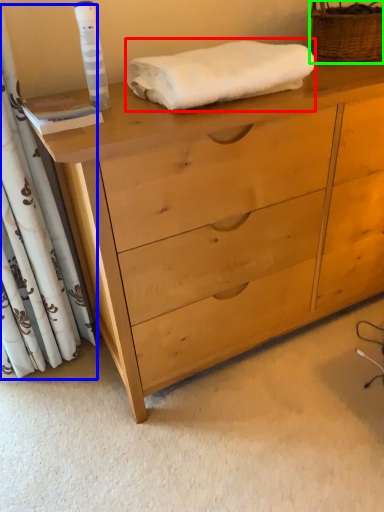
Question: Which object is positioned closest to bath towel (highlighted by a red box)? Select from curtain (highlighted by a blue box) and basket (highlighted by a green box).

Choices:
 (A) curtain
 (B) basket

Answer: (B)